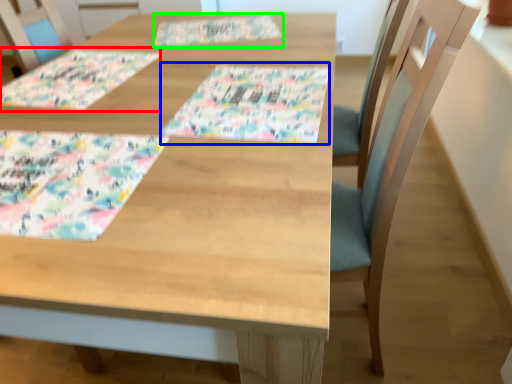
Question: Which object is the farthest from place mat (highlighted by a red box)? Choose among these: tablecloth (highlighted by a blue box) or place mat (highlighted by a green box).

Choices:
 (A) tablecloth
 (B) place mat

Answer: (A)